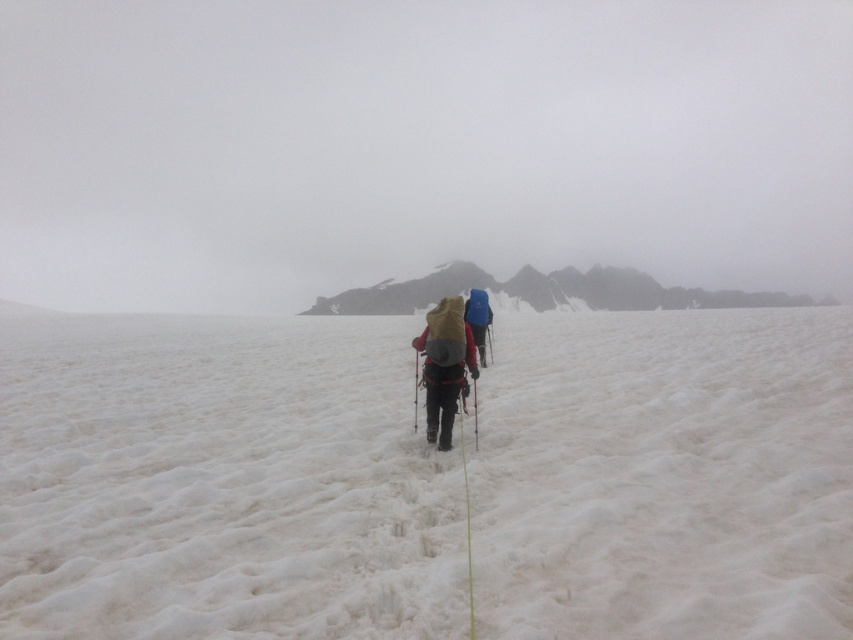
You are a drone operator trying to capture aerial footage of the two points in the snowy landscape. The first point is at coordinate point (705, 301) and the second is at point (437, 330). Which point should you prioritize filming first if you want to capture the closest one to the camera?

Point (705, 301) is closer to the camera than point (437, 330), so you should prioritize filming point (705, 301) first.

Based on the coordinates provided, which object in the scene is located at point (547, 291)?

The rugged stone mountain at center is located at point (547, 291).

You are a hiker planning to place a marker between the two points, point (466, 282) and point (485, 296). Which point is closer to you so that you can place the marker correctly?

Point (466, 282) is closer to you, so you should place the marker closer to that point.